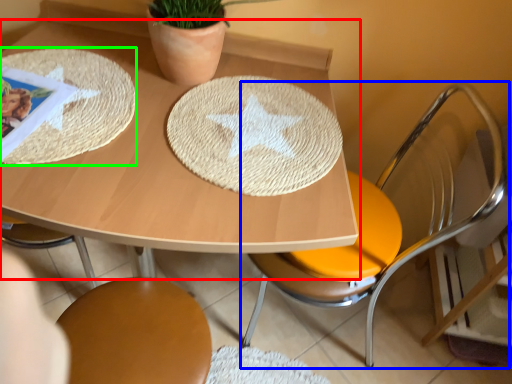
Question: Which object is the closest to the table (highlighted by a red box)? Choose among these: chair (highlighted by a blue box) or mat (highlighted by a green box).

Choices:
 (A) chair
 (B) mat

Answer: (B)